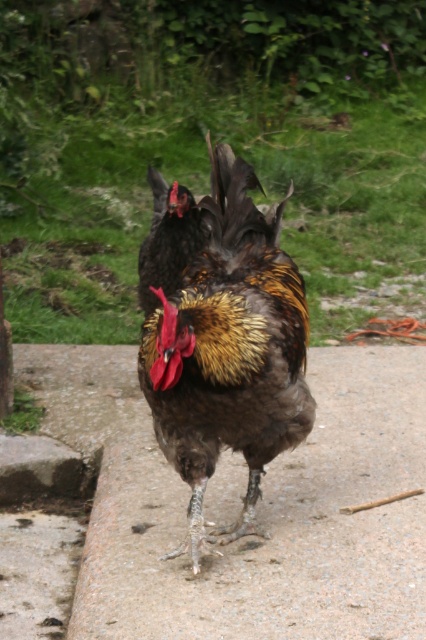
In the scene shown: You are a small bird flying over the gray concrete pavement at center and the brown feathered rooster at center. Which surface can you land on that is lower to the ground?

The gray concrete pavement at center is lower to the ground compared to the brown feathered rooster at center, so you can land on the gray concrete pavement at center.